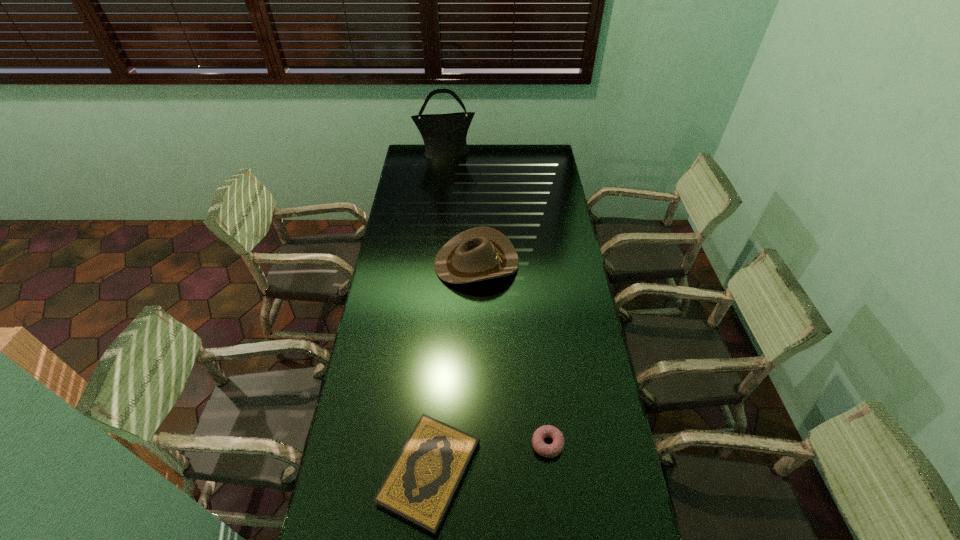
At what (x,y) coordinates should I click in order to perform the action: click on object that is at the far edge. Please return your answer as a coordinate pair (x, y). Looking at the image, I should click on click(x=444, y=135).

Where is `shoulder bag present at the left edge`? The width and height of the screenshot is (960, 540). shoulder bag present at the left edge is located at coordinates (444, 135).

Locate an element on the screen. This screenshot has height=540, width=960. hardback book positioned at the left edge is located at coordinates (420, 487).

You are a GUI agent. You are given a task and a screenshot of the screen. Output one action in this format:
    pyautogui.click(x=<x>, y=<y>)
    Task: Click on the object that is at the right edge
    The width and height of the screenshot is (960, 540).
    Given the screenshot: What is the action you would take?
    pyautogui.click(x=552, y=450)

This screenshot has height=540, width=960. Identify the location of object situated at the far left corner. (444, 135).

Identify the location of vacant space at the left edge. (373, 341).

You are a GUI agent. You are given a task and a screenshot of the screen. Output one action in this format:
    pyautogui.click(x=<x>, y=<y>)
    Task: Click on the free space at the right edge of the desktop
    
    Given the screenshot: What is the action you would take?
    pyautogui.click(x=545, y=269)

In the image, there is a desktop. Identify the location of blank space at the far right corner. (524, 145).

The width and height of the screenshot is (960, 540). I want to click on free space between the second tallest object and the doughnut, so click(512, 354).

Where is `vacant region between the hardback book and the doughnut`? vacant region between the hardback book and the doughnut is located at coordinates (489, 458).